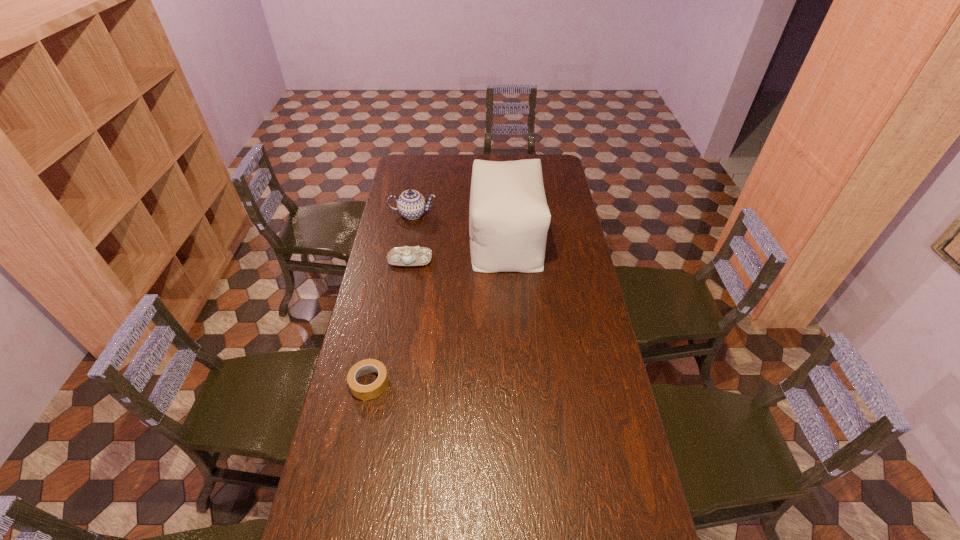
The height and width of the screenshot is (540, 960). What are the coordinates of `cushion` in the screenshot? It's located at (509, 218).

Where is `the rightmost object`? Image resolution: width=960 pixels, height=540 pixels. the rightmost object is located at coordinates (509, 218).

At what (x,y) coordinates should I click in order to perform the action: click on the third shortest object. Please return your answer as a coordinate pair (x, y). The width and height of the screenshot is (960, 540). Looking at the image, I should click on (411, 204).

What are the coordinates of `the taller chinaware` in the screenshot? It's located at (411, 204).

Locate an element on the screen. The height and width of the screenshot is (540, 960). the shorter chinaware is located at coordinates (402, 256).

Locate an element on the screen. the second shortest object is located at coordinates (402, 256).

The width and height of the screenshot is (960, 540). What are the coordinates of `the shortest object` in the screenshot? It's located at (364, 392).

Where is `the nearest object`? This screenshot has width=960, height=540. the nearest object is located at coordinates (364, 392).

Where is `free spot located 0.390m on the side of the tallest object with the smiley face`? Image resolution: width=960 pixels, height=540 pixels. free spot located 0.390m on the side of the tallest object with the smiley face is located at coordinates (385, 240).

Where is `free space located on the side of the tallest object with the smiley face`? The image size is (960, 540). free space located on the side of the tallest object with the smiley face is located at coordinates (428, 240).